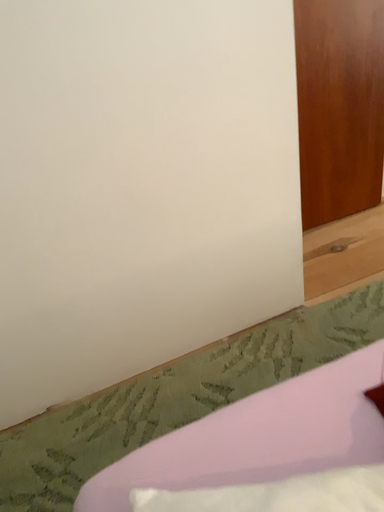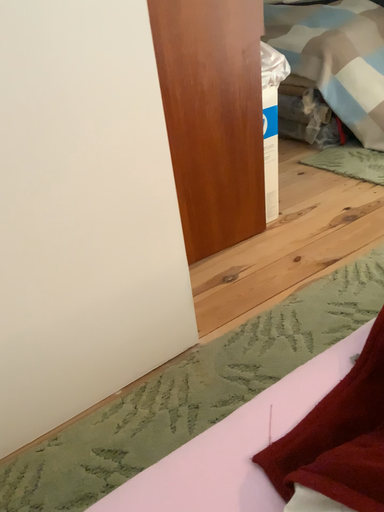
Question: How did the camera likely rotate when shooting the video?

Choices:
 (A) rotated right
 (B) rotated left

Answer: (A)